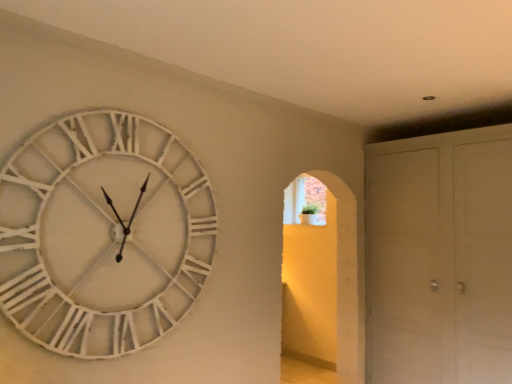
This screenshot has width=512, height=384. Describe the element at coordinates (440, 258) in the screenshot. I see `white matte cabinet at right` at that location.

Image resolution: width=512 pixels, height=384 pixels. Find the location of `white matte cabinet at right`. white matte cabinet at right is located at coordinates (440, 258).

What do you see at coordinates (103, 234) in the screenshot? Image resolution: width=512 pixels, height=384 pixels. I see `white wooden clock at upper left` at bounding box center [103, 234].

Locate an element on the screen. white wooden clock at upper left is located at coordinates click(x=103, y=234).

This screenshot has height=384, width=512. I want to click on white matte cabinet at right, so click(440, 258).

Between white wooden clock at upper left and white matte cabinet at right, which one appears on the left side from the viewer's perspective?

From the viewer's perspective, white wooden clock at upper left appears more on the left side.

In the image, is white wooden clock at upper left positioned in front of or behind white matte cabinet at right?

white wooden clock at upper left is positioned closer to the viewer than white matte cabinet at right.

Which is in front, point (89, 258) or point (497, 163)?

Positioned in front is point (89, 258).

From the image's perspective, is white wooden clock at upper left above white matte cabinet at right?

Correct, white wooden clock at upper left appears higher than white matte cabinet at right in the image.

From a real-world perspective, which object rests below the other?

From a 3D spatial view, white matte cabinet at right is below.

In the scene shown: Does white wooden clock at upper left have a greater width compared to white matte cabinet at right?

In fact, white wooden clock at upper left might be narrower than white matte cabinet at right.

Considering the sizes of objects white wooden clock at upper left and white matte cabinet at right in the image provided, who is shorter, white wooden clock at upper left or white matte cabinet at right?

A: With less height is white wooden clock at upper left.

Considering the sizes of objects white wooden clock at upper left and white matte cabinet at right in the image provided, who is bigger, white wooden clock at upper left or white matte cabinet at right?

white matte cabinet at right is bigger.

Is white wooden clock at upper left not inside white matte cabinet at right?

That's correct, white wooden clock at upper left is outside of white matte cabinet at right.

Is white wooden clock at upper left placed right next to white matte cabinet at right?

They are not placed beside each other.

Is white matte cabinet at right at the back of white wooden clock at upper left?

No, white wooden clock at upper left is not facing the opposite direction of white matte cabinet at right.

What's the angular difference between white wooden clock at upper left and white matte cabinet at right's facing directions?

They differ by 90.7 degrees in their facing directions.

Measure the distance between white wooden clock at upper left and white matte cabinet at right.

white wooden clock at upper left is 7.19 feet away from white matte cabinet at right.

This screenshot has height=384, width=512. I want to click on glass door lying behind the white wooden clock at upper left, so click(x=440, y=258).

Based on their positions, is white matte cabinet at right located to the left or right of white wooden clock at upper left?

Clearly, white matte cabinet at right is on the right of white wooden clock at upper left in the image.

Does white matte cabinet at right come behind white wooden clock at upper left?

Yes, white matte cabinet at right is behind white wooden clock at upper left.

Which point is more distant from viewer, (404,254) or (96,119)?

The point (404,254) is behind.

From the picture: From the image's perspective, between white matte cabinet at right and white wooden clock at upper left, who is located below?

white matte cabinet at right is shown below in the image.

In the scene shown: From a real-world perspective, does white matte cabinet at right stand above white wooden clock at upper left?

No, from a real-world perspective, white matte cabinet at right is not over white wooden clock at upper left

Considering the sizes of objects white matte cabinet at right and white wooden clock at upper left in the image provided, who is thinner, white matte cabinet at right or white wooden clock at upper left?

white wooden clock at upper left is thinner.

Does white matte cabinet at right have a lesser height compared to white wooden clock at upper left?

In fact, white matte cabinet at right may be taller than white wooden clock at upper left.

Is white matte cabinet at right bigger or smaller than white wooden clock at upper left?

white matte cabinet at right is bigger than white wooden clock at upper left.

Is white matte cabinet at right completely or partially outside of white wooden clock at upper left?

Yes.

Would you say white matte cabinet at right is a long distance from white wooden clock at upper left?

That's right, there is a large distance between white matte cabinet at right and white wooden clock at upper left.

Does white matte cabinet at right turn towards white wooden clock at upper left?

Yes, white matte cabinet at right faces towards white wooden clock at upper left.

From the picture: How different are the orientations of white matte cabinet at right and white wooden clock at upper left in degrees?

white matte cabinet at right and white wooden clock at upper left are facing 90.7 degrees away from each other.

This screenshot has width=512, height=384. I want to click on wall clock in front of the white matte cabinet at right, so click(x=103, y=234).

This screenshot has height=384, width=512. I want to click on wall clock that appears above the white matte cabinet at right (from a real-world perspective), so 103,234.

Locate an element on the screen. wall clock on the left of the white matte cabinet at right is located at coordinates (103, 234).